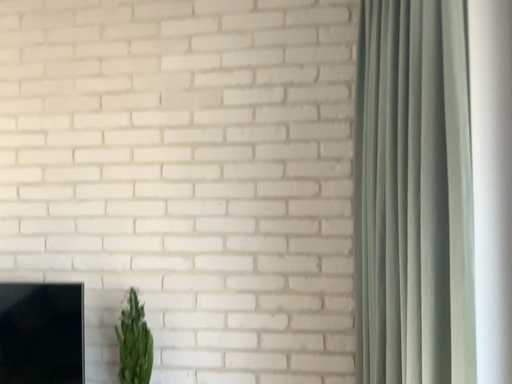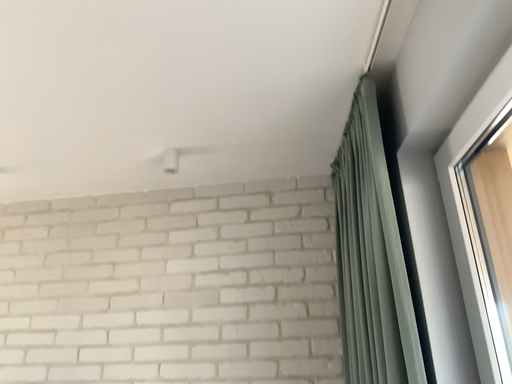
Question: Which way did the camera rotate in the video?

Choices:
 (A) rotated upward
 (B) rotated downward

Answer: (A)